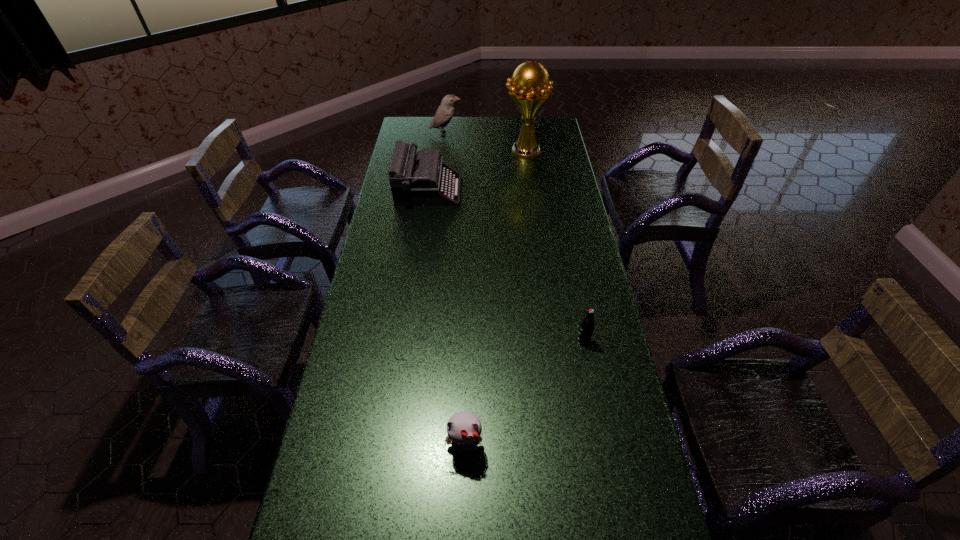
The width and height of the screenshot is (960, 540). In order to click on trophy_cup in this screenshot , I will do `click(530, 90)`.

This screenshot has height=540, width=960. Find the location of `the tallest object`. the tallest object is located at coordinates (530, 90).

Where is `the fifth shortest object`? the fifth shortest object is located at coordinates (445, 112).

The image size is (960, 540). In order to click on bird in this screenshot , I will do `click(445, 112)`.

The height and width of the screenshot is (540, 960). What are the coordinates of `the third farthest object` in the screenshot? It's located at (424, 180).

The width and height of the screenshot is (960, 540). I want to click on the fourth farthest object, so click(587, 325).

At what (x,y) coordinates should I click in order to perform the action: click on the farther kitten. Please return your answer as a coordinate pair (x, y). The height and width of the screenshot is (540, 960). Looking at the image, I should click on (464, 429).

At what (x,y) coordinates should I click in order to perform the action: click on the left kitten. Please return your answer as a coordinate pair (x, y). This screenshot has width=960, height=540. Looking at the image, I should click on (464, 429).

This screenshot has height=540, width=960. I want to click on vacant region located 0.230m at the front of the tallest object where the globe is prominent, so click(455, 151).

Find the location of `free point located 0.140m at the front of the tallest object where the globe is prominent`. free point located 0.140m at the front of the tallest object where the globe is prominent is located at coordinates (473, 151).